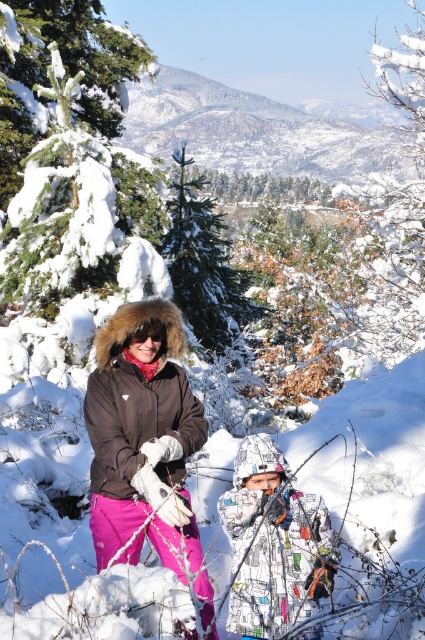
Which is more to the left, matte brown jacket at center or printed fabric snowsuit at center?

matte brown jacket at center is more to the left.

Does matte brown jacket at center lie in front of printed fabric snowsuit at center?

No, it is behind printed fabric snowsuit at center.

Is point (183, 374) behind point (274, 522)?

Yes, it is behind point (274, 522).

At what (x,y) coordinates should I click in order to perform the action: click on matte brown jacket at center. Please return your answer as a coordinate pair (x, y). This screenshot has width=425, height=640. Looking at the image, I should click on (141, 440).

Who is positioned more to the left, printed fabric snowsuit at center or matte black goggles at center?

Positioned to the left is matte black goggles at center.

Between point (257, 467) and point (144, 339), which one is positioned in front?

Point (257, 467) is more forward.

Between point (305, 518) and point (163, 333), which one is positioned behind?

The point (163, 333) is more distant.

Where is `printed fabric snowsuit at center`? The image size is (425, 640). printed fabric snowsuit at center is located at coordinates (274, 544).

In order to click on matte brown jacket at center in this screenshot , I will do `click(141, 440)`.

Does matte brown jacket at center have a greater height compared to green textured pine tree at center?

In fact, matte brown jacket at center may be shorter than green textured pine tree at center.

Locate an element on the screen. matte brown jacket at center is located at coordinates (141, 440).

Locate an element on the screen. matte brown jacket at center is located at coordinates (141, 440).